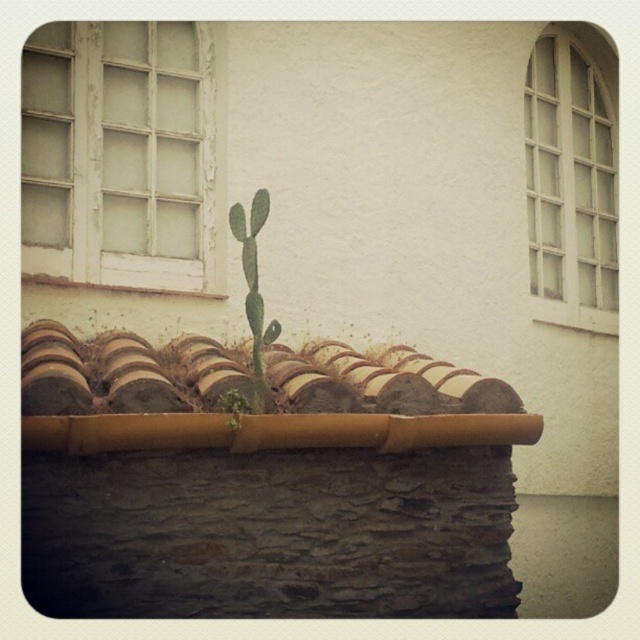
Does white wooden window at upper left have a greater width compared to white wooden grid at upper right?

Yes.

Can you confirm if white wooden window at upper left is positioned to the left of white wooden grid at upper right?

Indeed, white wooden window at upper left is positioned on the left side of white wooden grid at upper right.

What are the coordinates of `white wooden window at upper left` in the screenshot? It's located at (122, 156).

Who is taller, white wooden window at upper left or brown clay tiles at center?

white wooden window at upper left is taller.

Does white wooden window at upper left have a smaller size compared to brown clay tiles at center?

Yes.

This screenshot has width=640, height=640. Describe the element at coordinates (122, 156) in the screenshot. I see `white wooden window at upper left` at that location.

What are the coordinates of `white wooden window at upper left` in the screenshot? It's located at (122, 156).

Where is `brown clay tiles at center`? brown clay tiles at center is located at coordinates (124, 372).

Between brown clay tiles at center and green spiny cactus at center, which one appears on the right side from the viewer's perspective?

From the viewer's perspective, green spiny cactus at center appears more on the right side.

Is point (419, 369) more distant than point (262, 365)?

Yes.

At what (x,y) coordinates should I click in order to perform the action: click on brown clay tiles at center. Please return your answer as a coordinate pair (x, y). Looking at the image, I should click on (124, 372).